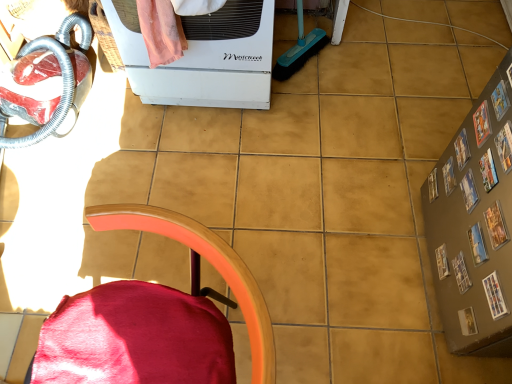
Question: From a real-world perspective, is velvet red chair at lower left located higher than white matte appliance at upper center?

Choices:
 (A) no
 (B) yes

Answer: (B)

Question: Is velvet red chair at lower left surrounding white matte appliance at upper center?

Choices:
 (A) yes
 (B) no

Answer: (B)

Question: Considering the relative sizes of velvet red chair at lower left and white matte appliance at upper center in the image provided, is velvet red chair at lower left shorter than white matte appliance at upper center?

Choices:
 (A) no
 (B) yes

Answer: (A)

Question: Considering the relative sizes of velvet red chair at lower left and white matte appliance at upper center in the image provided, is velvet red chair at lower left thinner than white matte appliance at upper center?

Choices:
 (A) yes
 (B) no

Answer: (A)

Question: Is velvet red chair at lower left smaller than white matte appliance at upper center?

Choices:
 (A) yes
 (B) no

Answer: (A)

Question: Is velvet red chair at lower left in front of white matte appliance at upper center?

Choices:
 (A) no
 (B) yes

Answer: (B)

Question: Does white matte appliance at upper center appear on the right side of velvet red chair at lower left?

Choices:
 (A) yes
 (B) no

Answer: (A)

Question: Is white matte appliance at upper center bigger than velvet red chair at lower left?

Choices:
 (A) yes
 (B) no

Answer: (A)

Question: Is white matte appliance at upper center positioned behind velvet red chair at lower left?

Choices:
 (A) no
 (B) yes

Answer: (B)

Question: Can you confirm if white matte appliance at upper center is shorter than velvet red chair at lower left?

Choices:
 (A) no
 (B) yes

Answer: (B)

Question: Can velvet red chair at lower left be found inside white matte appliance at upper center?

Choices:
 (A) no
 (B) yes

Answer: (A)

Question: Is white matte appliance at upper center not close to velvet red chair at lower left?

Choices:
 (A) yes
 (B) no

Answer: (B)

Question: Considering their positions, is white matte appliance at upper center located in front of or behind velvet red chair at lower left?

Choices:
 (A) behind
 (B) front

Answer: (A)